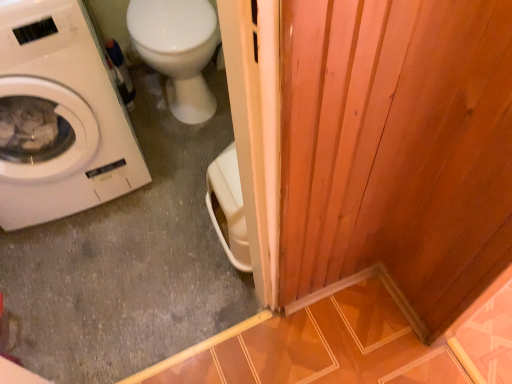
The width and height of the screenshot is (512, 384). I want to click on white matte washing machine at left, so click(63, 116).

What do you see at coordinates (63, 116) in the screenshot? Image resolution: width=512 pixels, height=384 pixels. I see `white matte washing machine at left` at bounding box center [63, 116].

Measure the distance between point (x=164, y=45) and camera.

They are 5.46 feet apart.

You are a GUI agent. You are given a task and a screenshot of the screen. Output one action in this format:
    pyautogui.click(x=<x>, y=<y>)
    Task: Click on the white glossy toilet at upper left
    The height and width of the screenshot is (384, 512).
    Given the screenshot: What is the action you would take?
    pyautogui.click(x=178, y=50)

What do you see at coordinates (178, 50) in the screenshot? I see `white glossy toilet at upper left` at bounding box center [178, 50].

I want to click on white matte washing machine at left, so click(x=63, y=116).

Looking at this image, which object is positioned more to the left, white matte washing machine at left or white glossy toilet at upper left?

From the viewer's perspective, white matte washing machine at left appears more on the left side.

Which object is closer to the camera, white matte washing machine at left or white glossy toilet at upper left?

white matte washing machine at left.

Does point (54, 158) appear closer or farther from the camera than point (203, 22)?

Point (54, 158).

From the image's perspective, is white matte washing machine at left positioned above or below white glossy toilet at upper left?

Clearly, from the image's perspective, white matte washing machine at left is below white glossy toilet at upper left.

From a real-world perspective, which object stands above the other?

white matte washing machine at left is physically above.

Can you confirm if white matte washing machine at left is thinner than white glossy toilet at upper left?

Yes, white matte washing machine at left is thinner than white glossy toilet at upper left.

Which of these two, white matte washing machine at left or white glossy toilet at upper left, stands shorter?

white glossy toilet at upper left is shorter.

Based on the photo, between white matte washing machine at left and white glossy toilet at upper left, which one has larger size?

Bigger between the two is white matte washing machine at left.

Is white matte washing machine at left situated inside white glossy toilet at upper left or outside?

white matte washing machine at left is spatially situated outside white glossy toilet at upper left.

Are white matte washing machine at left and white glossy toilet at upper left making contact?

white matte washing machine at left and white glossy toilet at upper left are clearly separated.

Is white matte washing machine at left oriented towards white glossy toilet at upper left?

No, white matte washing machine at left is not oriented towards white glossy toilet at upper left.

The height and width of the screenshot is (384, 512). Identify the location of toilet below the white matte washing machine at left (from a real-world perspective). (178, 50).

Consider the image. Which object is positioned more to the left, white glossy toilet at upper left or white matte washing machine at left?

white matte washing machine at left is more to the left.

Is white glossy toilet at upper left positioned before white matte washing machine at left?

No, it is not.

Which is behind, point (152, 11) or point (12, 86)?

The point (152, 11) is farther.

From the image's perspective, is white glossy toilet at upper left located above white matte washing machine at left?

Yes, from the image's perspective, white glossy toilet at upper left is above white matte washing machine at left.

From a real-world perspective, which is physically above, white glossy toilet at upper left or white matte washing machine at left?

white matte washing machine at left, from a real-world perspective.

Does white glossy toilet at upper left have a greater width compared to white matte washing machine at left?

Yes.

Between white glossy toilet at upper left and white matte washing machine at left, which one has less height?

white glossy toilet at upper left.

From the picture: Does white glossy toilet at upper left have a smaller size compared to white matte washing machine at left?

Correct, white glossy toilet at upper left occupies less space than white matte washing machine at left.

In the scene shown: Is white glossy toilet at upper left positioned beyond the bounds of white matte washing machine at left?

Yes, white glossy toilet at upper left is located beyond the bounds of white matte washing machine at left.

Are white glossy toilet at upper left and white matte washing machine at left beside each other?

white glossy toilet at upper left and white matte washing machine at left are clearly separated.

Is white glossy toilet at upper left turned away from white matte washing machine at left?

No, white matte washing machine at left is not at the back of white glossy toilet at upper left.

Can you tell me how much white glossy toilet at upper left and white matte washing machine at left differ in facing direction?

The facing directions of white glossy toilet at upper left and white matte washing machine at left are 2.58 degrees apart.

Measure the distance from white glossy toilet at upper left to white matte washing machine at left.

white glossy toilet at upper left is 49.25 centimeters from white matte washing machine at left.

Locate an element on the screen. washing machine in front of the white glossy toilet at upper left is located at coordinates pyautogui.click(x=63, y=116).

Where is `toilet behind the white matte washing machine at left`? toilet behind the white matte washing machine at left is located at coordinates (178, 50).

In order to click on toilet on the right of white matte washing machine at left in this screenshot , I will do `click(178, 50)`.